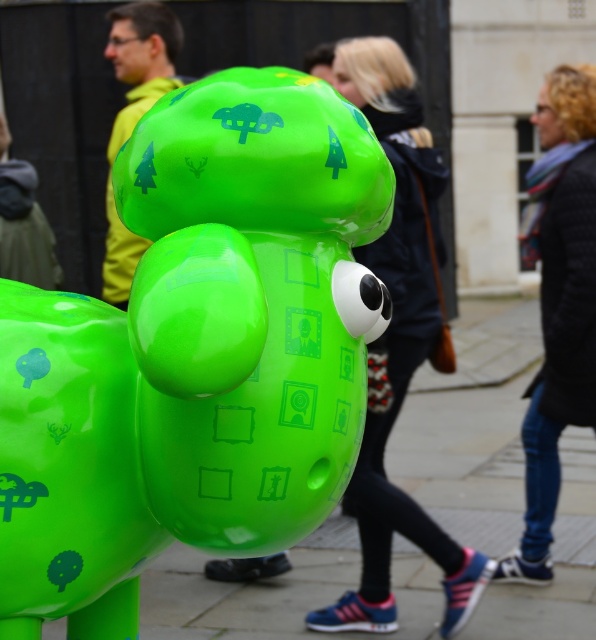
Question: Which of the following is the closest to the observer?

Choices:
 (A) click(539, 140)
 (B) click(355, 497)

Answer: (B)

Question: Can you confirm if glossy plastic toy at center is positioned below matte yellow jacket at upper left?

Choices:
 (A) no
 (B) yes

Answer: (B)

Question: Where is glossy green balloon at center located in relation to matte green sculpture at center in the image?

Choices:
 (A) above
 (B) below

Answer: (B)

Question: Considering the real-world distances, which object is farthest from the matte green sculpture at center?

Choices:
 (A) black textured coat at right
 (B) glossy green balloon at center
 (C) matte yellow jacket at upper left
 (D) glossy plastic toy at center

Answer: (B)

Question: Does glossy plastic toy at center lie in front of matte green sculpture at center?

Choices:
 (A) yes
 (B) no

Answer: (A)

Question: Among these points, which one is farthest from the camera?

Choices:
 (A) (212, 243)
 (B) (157, 77)
 (C) (530, 237)

Answer: (B)